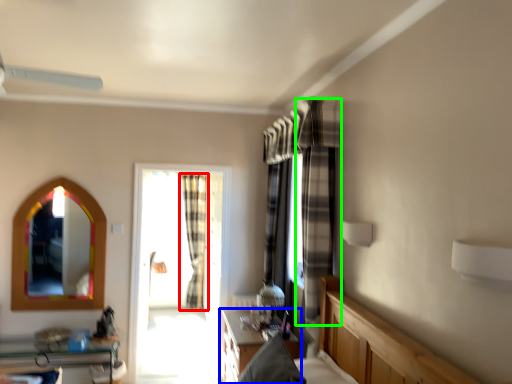
Question: Which is nearer to the curtain (highlighted by a red box)? table (highlighted by a blue box) or curtain (highlighted by a green box).

Choices:
 (A) table
 (B) curtain

Answer: (A)